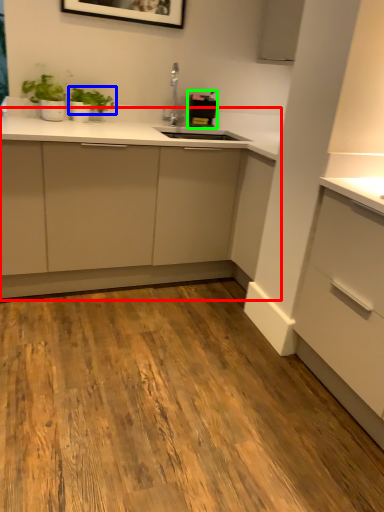
Question: Based on their relative distances, which object is nearer to cabinetry (highlighted by a red box)? Choose from plant (highlighted by a blue box) and appliance (highlighted by a green box).

Choices:
 (A) plant
 (B) appliance

Answer: (B)